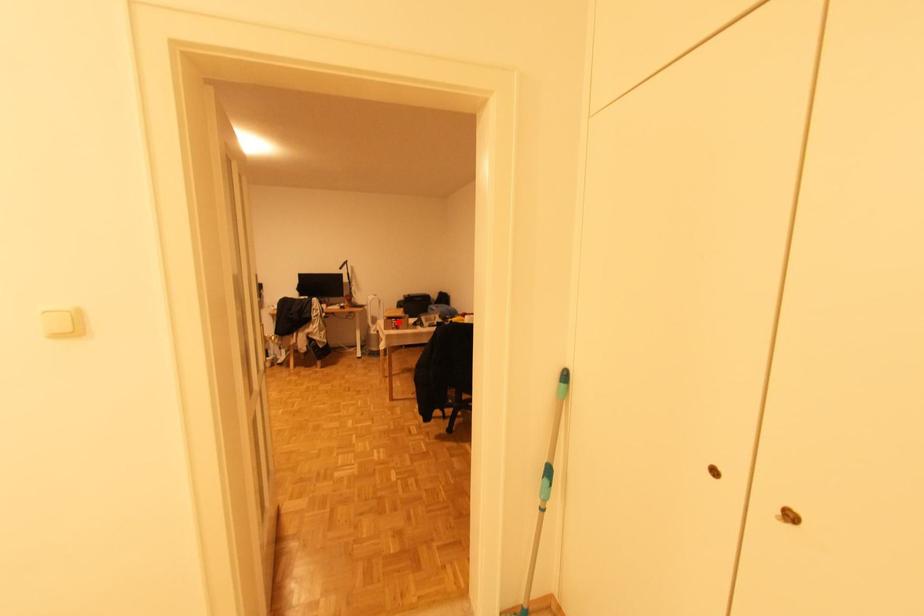
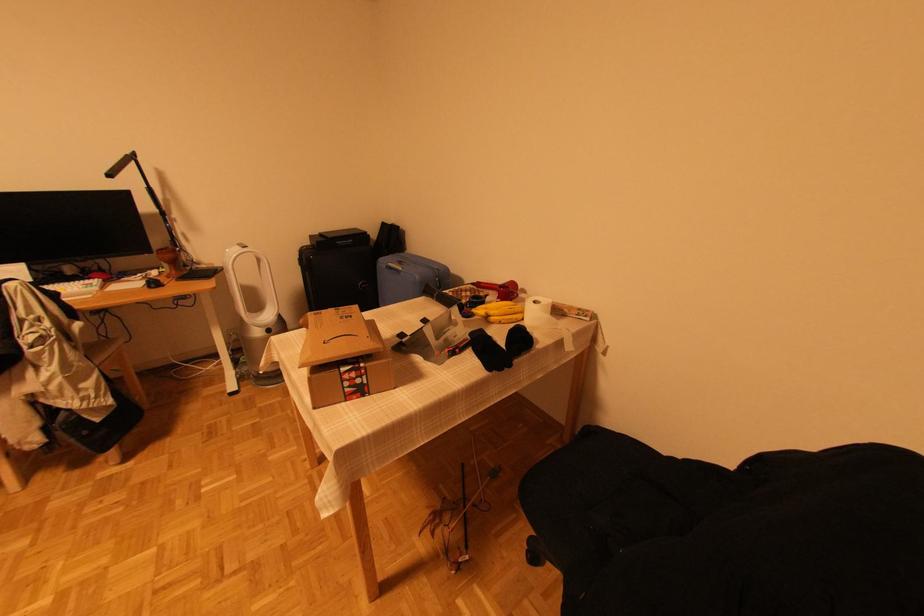
Question: I am providing you with two images of the same scene from different viewpoints. A red point is shown in image1. For the corresponding object point in image2, is it positioned nearer or farther from the camera?

Choices:
 (A) Nearer
 (B) Farther

Answer: (B)